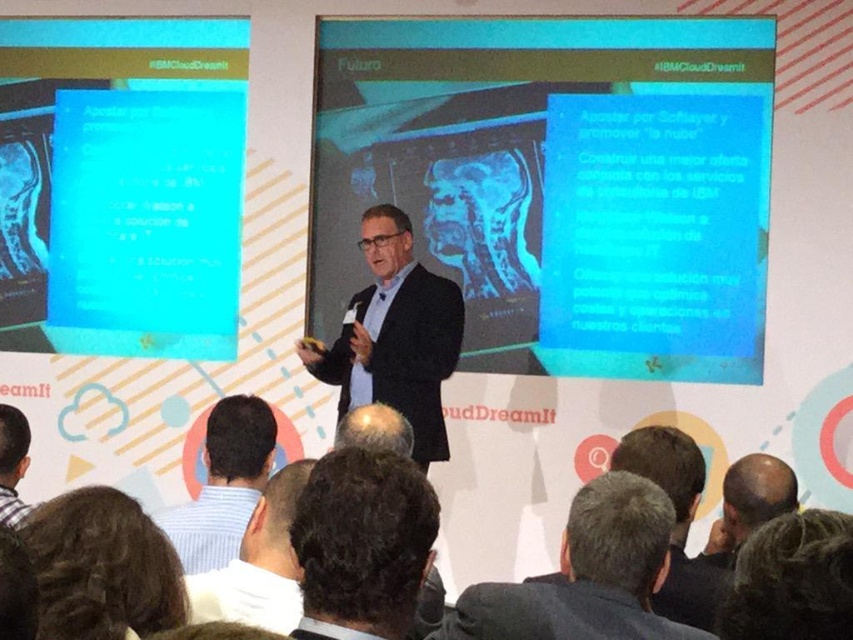
Question: Which point is closer to the camera?

Choices:
 (A) (86, 500)
 (B) (419, 458)

Answer: (A)

Question: Is blue glossy text box at upper left wider than striped shirt at lower left?

Choices:
 (A) yes
 (B) no

Answer: (A)

Question: Which point is farther from the camera taking this photo?

Choices:
 (A) (636, 528)
 (B) (103, 269)
 (C) (392, 326)

Answer: (B)

Question: Which object appears closest to the camera in this image?

Choices:
 (A) dark gray fabric business suit at lower center
 (B) dark brown hair at lower left
 (C) white striped shirt at lower left
 (D) dark gray suit at center

Answer: (B)

Question: Does dark gray suit at center have a smaller size compared to striped shirt at lower left?

Choices:
 (A) yes
 (B) no

Answer: (A)

Question: Does dark gray suit at center come in front of dark brown hair at lower right?

Choices:
 (A) no
 (B) yes

Answer: (A)